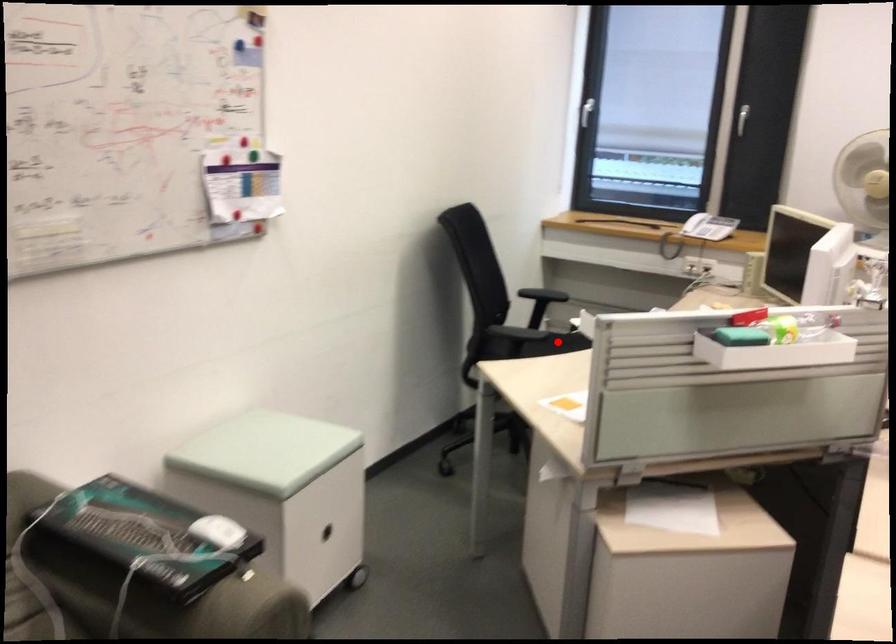
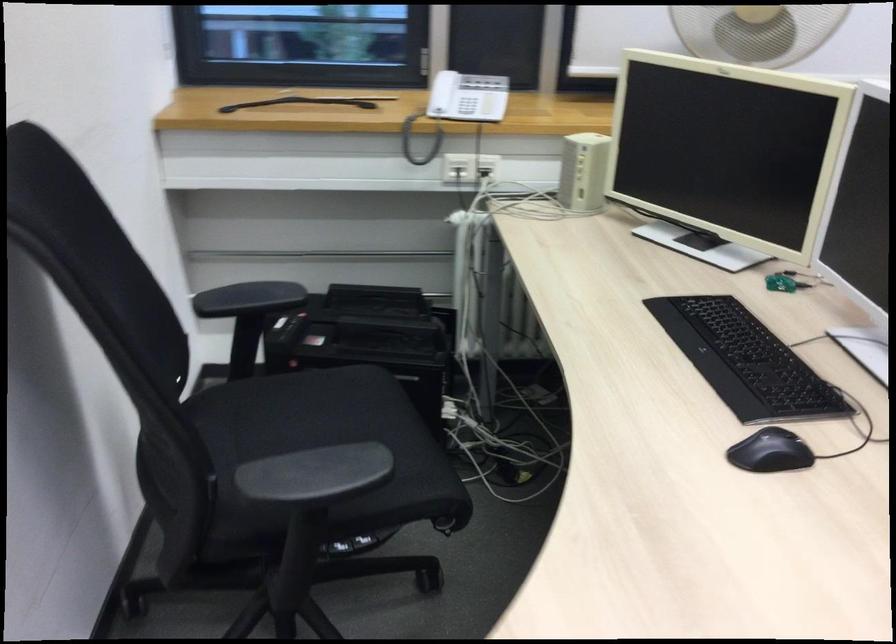
Find the pixel in the second image that matches the highlighted location in the first image.

(309, 408)